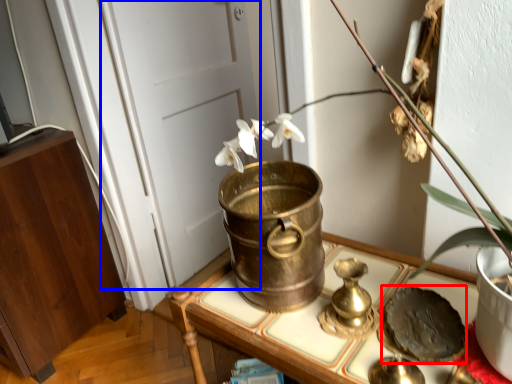
Question: Which object is further to the camera taking this photo, food (highlighted by a red box) or door (highlighted by a blue box)?

Choices:
 (A) food
 (B) door

Answer: (B)